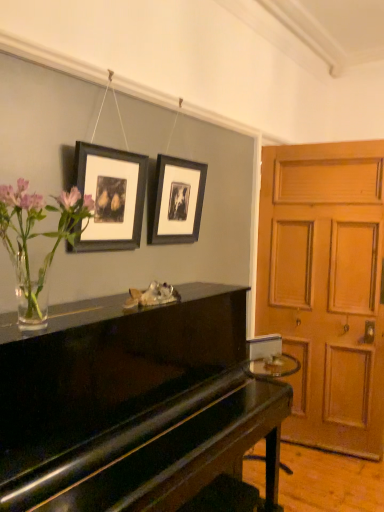
This screenshot has height=512, width=384. I want to click on free space above matte black picture frame at upper center, the first picture frame when ordered from front to back (from a real-world perspective), so click(x=110, y=148).